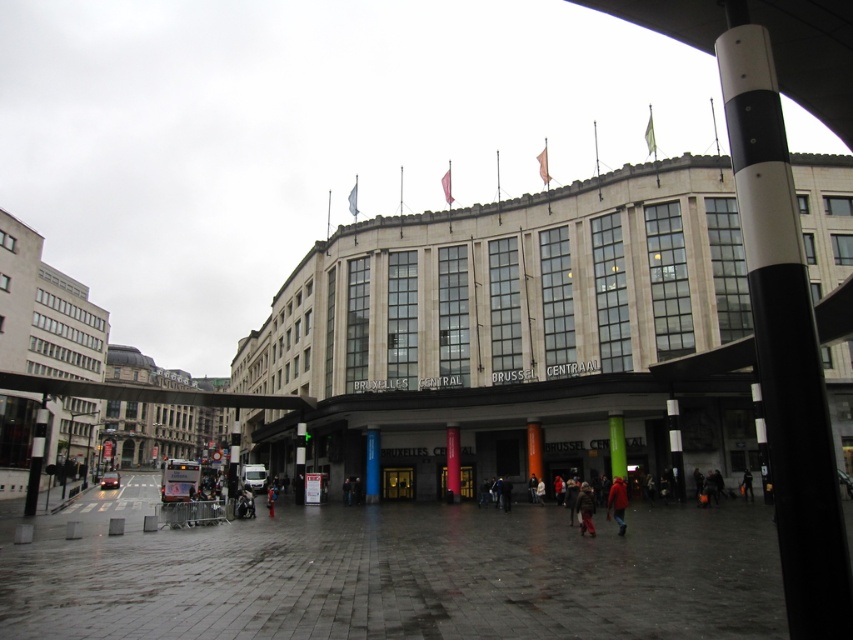
Question: Can you confirm if beige stone building at center is positioned to the left of dark brown leather jacket at center?

Choices:
 (A) no
 (B) yes

Answer: (B)

Question: Does beige stone building at center appear under black and white striped pole at upper right?

Choices:
 (A) yes
 (B) no

Answer: (A)

Question: Is beige stone building at center to the left of red wool coat at lower center from the viewer's perspective?

Choices:
 (A) yes
 (B) no

Answer: (A)

Question: Which object is the closest to the black and white striped pole at upper right?

Choices:
 (A) beige stone building at center
 (B) dark brown leather jacket at center
 (C) red wool coat at lower center

Answer: (C)

Question: Which point is closer to the camera?

Choices:
 (A) (608, 504)
 (B) (778, 124)
 (C) (577, 244)

Answer: (B)

Question: Which of the following is the farthest from the observer?

Choices:
 (A) (573, 339)
 (B) (611, 499)

Answer: (A)